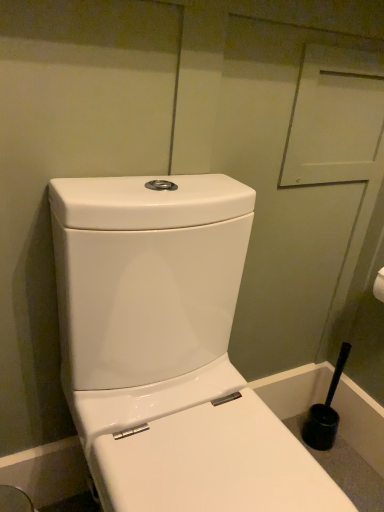
Question: Considering the relative positions of white glossy toilet at center and black plastic toilet brush at lower right in the image provided, is white glossy toilet at center to the left of black plastic toilet brush at lower right from the viewer's perspective?

Choices:
 (A) no
 (B) yes

Answer: (B)

Question: Is white glossy toilet at center beside black plastic toilet brush at lower right?

Choices:
 (A) yes
 (B) no

Answer: (B)

Question: Does white glossy toilet at center have a smaller size compared to black plastic toilet brush at lower right?

Choices:
 (A) no
 (B) yes

Answer: (A)

Question: Is white glossy toilet at center shorter than black plastic toilet brush at lower right?

Choices:
 (A) yes
 (B) no

Answer: (B)

Question: From a real-world perspective, is white glossy toilet at center located higher than black plastic toilet brush at lower right?

Choices:
 (A) no
 (B) yes

Answer: (B)

Question: Can you confirm if white glossy toilet at center is taller than black plastic toilet brush at lower right?

Choices:
 (A) no
 (B) yes

Answer: (B)

Question: Does black plastic toilet brush at lower right come in front of white glossy toilet at center?

Choices:
 (A) no
 (B) yes

Answer: (A)

Question: Is black plastic toilet brush at lower right directly adjacent to white glossy toilet at center?

Choices:
 (A) yes
 (B) no

Answer: (B)

Question: Is black plastic toilet brush at lower right thinner than white glossy toilet at center?

Choices:
 (A) yes
 (B) no

Answer: (A)

Question: Is black plastic toilet brush at lower right located outside white glossy toilet at center?

Choices:
 (A) yes
 (B) no

Answer: (A)

Question: Is black plastic toilet brush at lower right facing towards white glossy toilet at center?

Choices:
 (A) yes
 (B) no

Answer: (B)

Question: Is black plastic toilet brush at lower right bigger than white glossy toilet at center?

Choices:
 (A) yes
 (B) no

Answer: (B)

Question: Is white glossy toilet at center situated inside black plastic toilet brush at lower right or outside?

Choices:
 (A) inside
 (B) outside

Answer: (B)